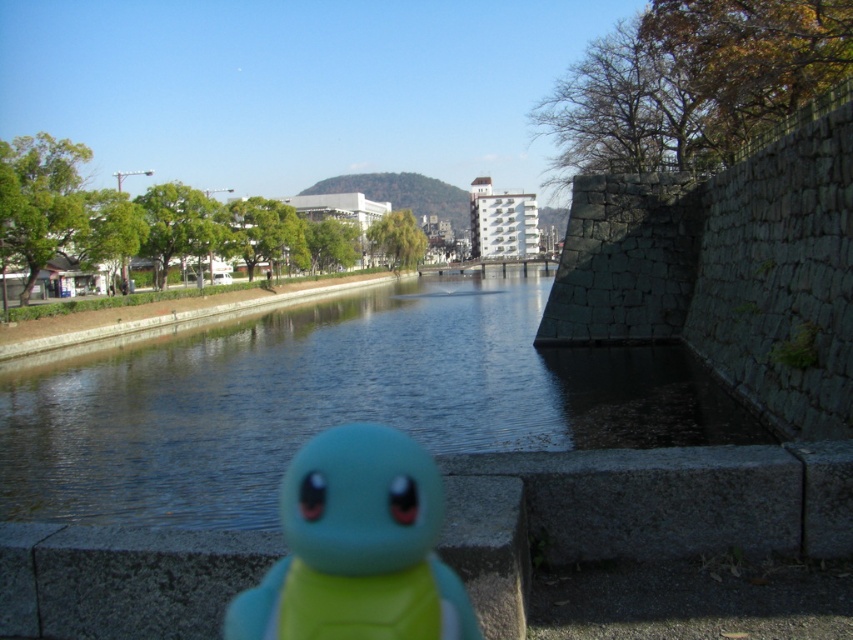
Question: Which point is farther to the camera?

Choices:
 (A) (309, 627)
 (B) (223, 515)

Answer: (B)

Question: Does blue water at center lie in front of teal rubber toy at center?

Choices:
 (A) no
 (B) yes

Answer: (A)

Question: Is blue water at center to the left of teal rubber toy at center from the viewer's perspective?

Choices:
 (A) yes
 (B) no

Answer: (A)

Question: Does blue water at center have a smaller size compared to teal rubber toy at center?

Choices:
 (A) yes
 (B) no

Answer: (B)

Question: Which point is closer to the camera?

Choices:
 (A) (405, 515)
 (B) (55, 496)

Answer: (A)